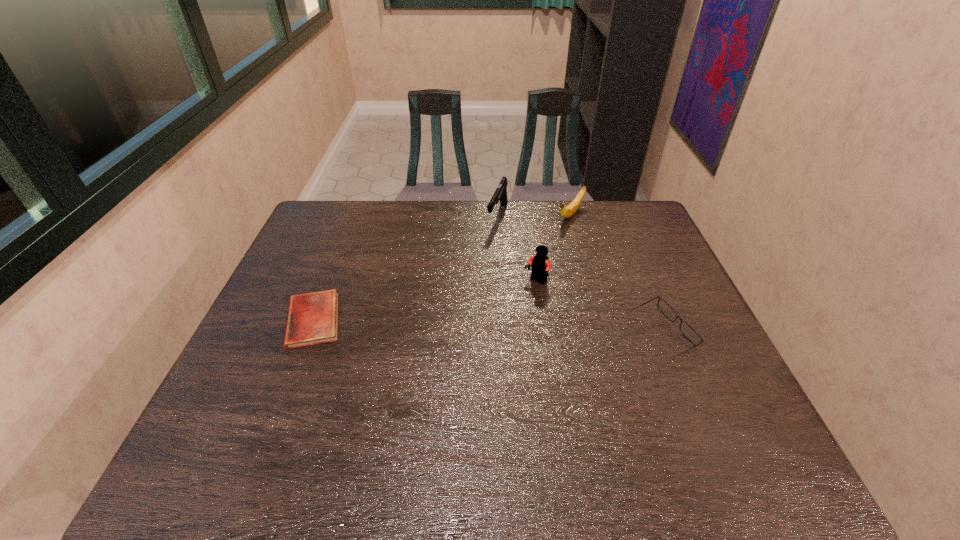
Image resolution: width=960 pixels, height=540 pixels. I want to click on free space that is in between the leftmost object and the second object from left to right, so click(x=405, y=268).

What are the coordinates of `free space between the second shortest object and the fourth object from left to right` in the screenshot? It's located at (616, 275).

Image resolution: width=960 pixels, height=540 pixels. In order to click on free area in between the banana and the gun in this screenshot , I will do (x=534, y=215).

The height and width of the screenshot is (540, 960). I want to click on vacant area that lies between the gun and the fourth tallest object, so click(580, 276).

Locate an element on the screen. The image size is (960, 540). vacant space that's between the third tallest object and the shortest object is located at coordinates (442, 267).

I want to click on vacant area that lies between the third object from left to right and the shortest object, so click(424, 301).

Locate an element on the screen. The image size is (960, 540). free area in between the fourth object from right to left and the shortest object is located at coordinates pos(405,268).

Where is `free space between the spectacles and the third object from right to left`? The height and width of the screenshot is (540, 960). free space between the spectacles and the third object from right to left is located at coordinates 599,309.

Locate an element on the screen. object that is the second closest to the fourth object from left to right is located at coordinates (540, 265).

Identify which object is located as the second nearest to the gun. Please provide its 2D coordinates. Your answer should be formatted as a tuple, i.e. [(x, y)], where the tuple contains the x and y coordinates of a point satisfying the conditions above.

[(540, 265)]